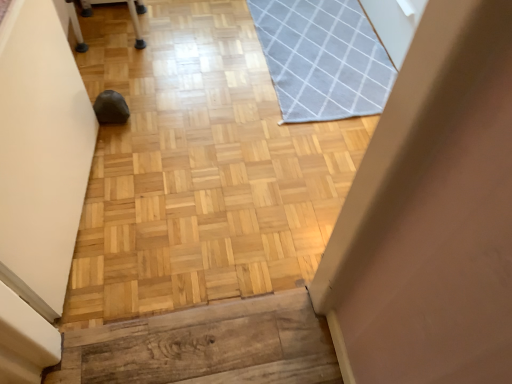
Find the location of a particular element. This screenshot has height=384, width=512. vacant area that lies between matte white plastic chair at upper left and gray woven mat at upper right is located at coordinates (203, 56).